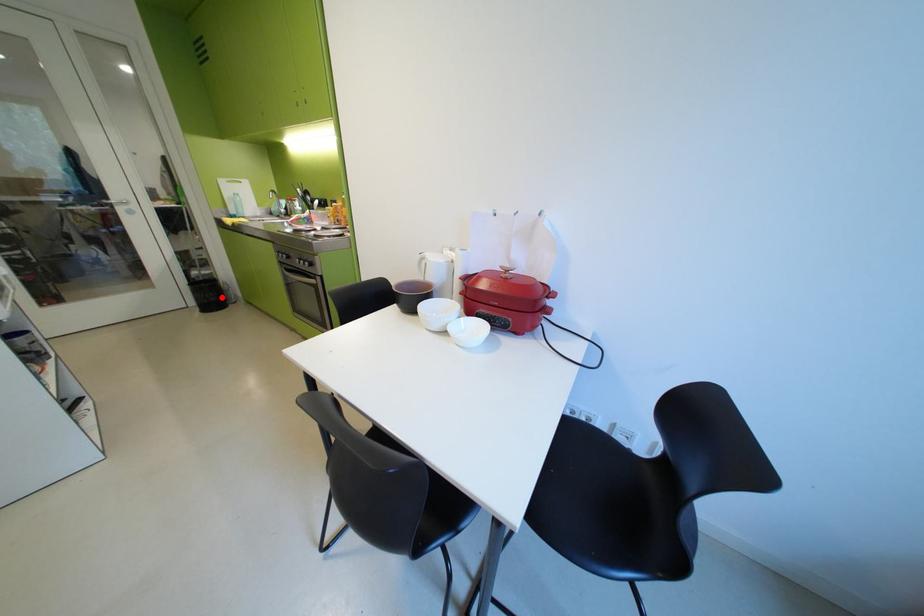
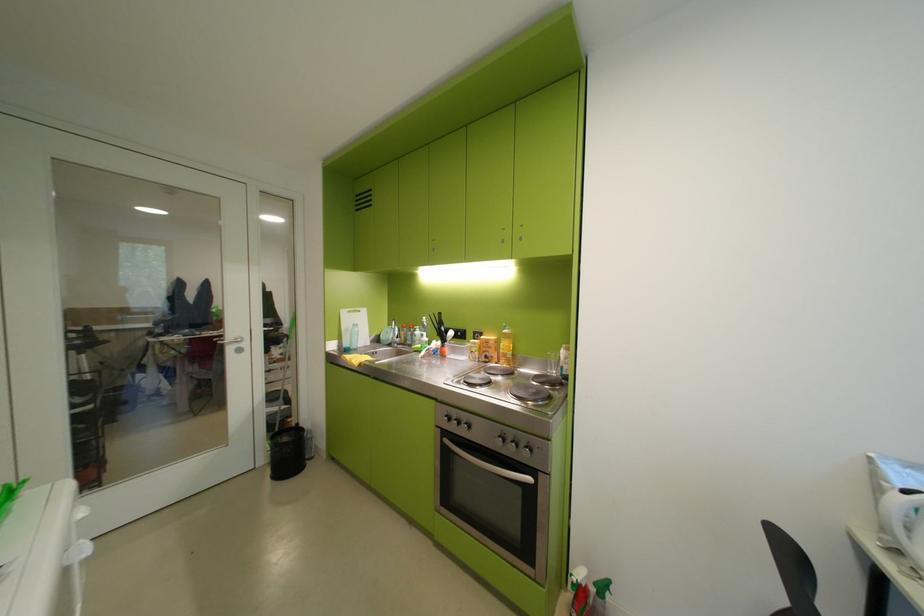
Question: I am providing you with two images of the same scene from different viewpoints. In image1, a red point is highlighted. Considering the same 3D point in image2, which of the following is correct?

Choices:
 (A) It is closer
 (B) It is farther

Answer: (B)